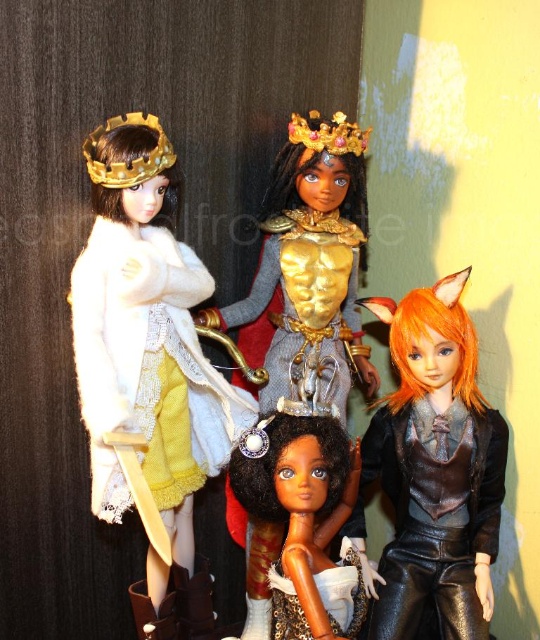
Is matte white coat at upper left to the right of white fuzzy coat at left from the viewer's perspective?

Indeed, matte white coat at upper left is positioned on the right side of white fuzzy coat at left.

In the scene shown: Can you confirm if matte white coat at upper left is shorter than white fuzzy coat at left?

No, matte white coat at upper left is not shorter than white fuzzy coat at left.

Which is behind, point (320, 195) or point (216, 419)?

The point (320, 195) is behind.

Locate an element on the screen. matte white coat at upper left is located at coordinates (146, 365).

Is white fuzzy coat at left to the left of gold woven crown at upper left from the viewer's perspective?

Incorrect, white fuzzy coat at left is not on the left side of gold woven crown at upper left.

Does point (200, 442) come closer to viewer compared to point (86, 156)?

No.

At what (x,y) coordinates should I click in order to perform the action: click on white fuzzy coat at left. Please return your answer as a coordinate pair (x, y). This screenshot has width=540, height=640. Looking at the image, I should click on (145, 337).

Is matte white coat at upper left further to the viewer compared to gold woven crown at upper left?

No, matte white coat at upper left is in front of gold woven crown at upper left.

Can you confirm if matte white coat at upper left is positioned above gold woven crown at upper left?

Incorrect, matte white coat at upper left is not positioned above gold woven crown at upper left.

Between point (302, 307) and point (157, 168), which one is positioned in front?

Point (157, 168) is in front.

Where is `matte white coat at upper left`? matte white coat at upper left is located at coordinates (146, 365).